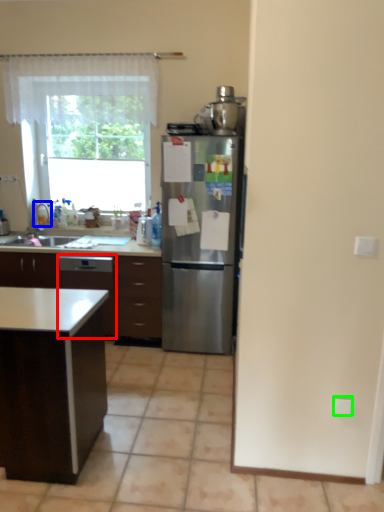
Question: Which object is the farthest from dish washer (highlighted by a red box)? Choose among these: faucet (highlighted by a blue box) or electric outlet (highlighted by a green box).

Choices:
 (A) faucet
 (B) electric outlet

Answer: (B)